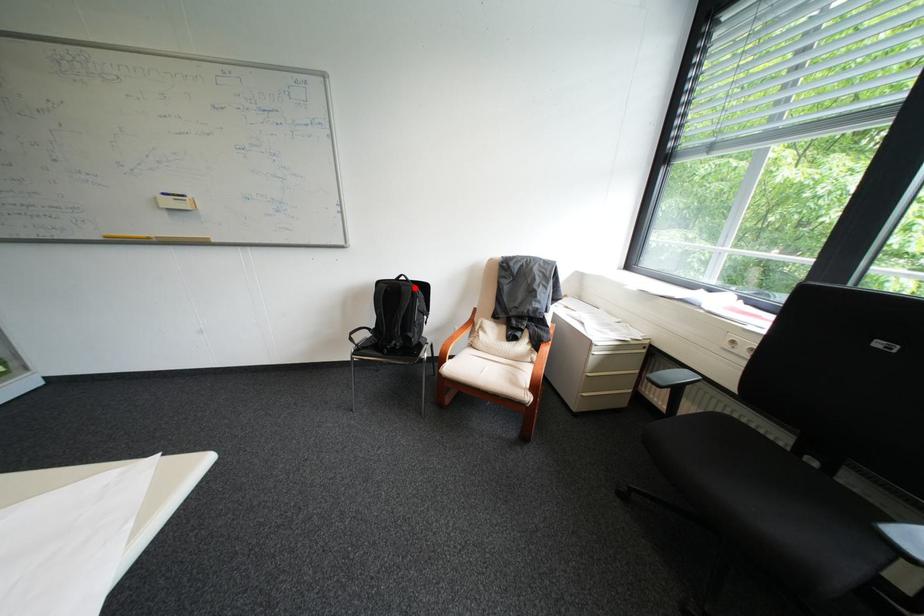
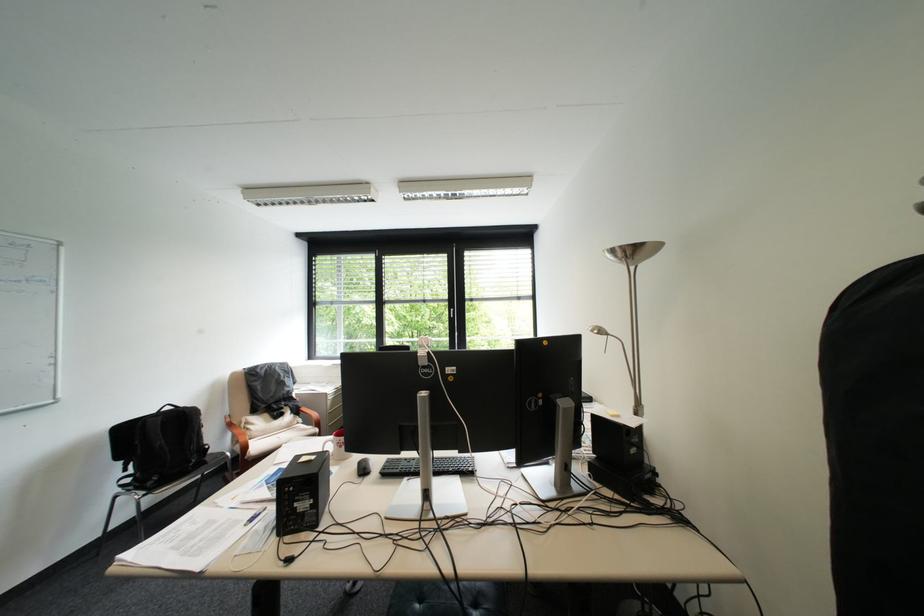
In the second image, find the point that corresponds to the highlighted location in the first image.

(198, 411)